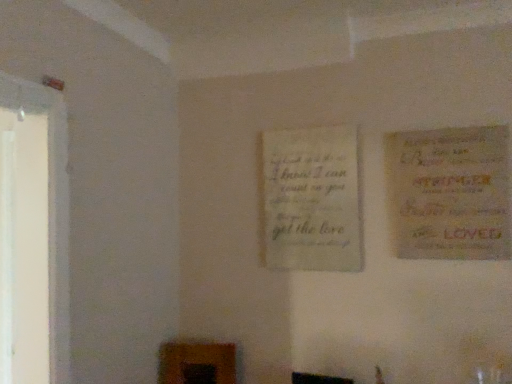
Question: Looking at the image, does light beige paper at center, the first poster from the left, seem bigger or smaller compared to yellow paper poster at right, which appears as the 1th poster when viewed from the right?

Choices:
 (A) small
 (B) big

Answer: (A)

Question: From a real-world perspective, is light beige paper at center, the 2th poster in the right-to-left sequence, physically located above or below yellow paper poster at right, acting as the first poster starting from the front?

Choices:
 (A) above
 (B) below

Answer: (B)

Question: Is point (307, 220) closer or farther from the camera than point (501, 172)?

Choices:
 (A) closer
 (B) farther

Answer: (B)

Question: From the image's perspective, is yellow paper poster at right, which appears as the 1th poster when viewed from the right, above or below light beige paper at center, marked as the first poster in a back-to-front arrangement?

Choices:
 (A) above
 (B) below

Answer: (A)

Question: Is yellow paper poster at right, marked as the 2th poster in a left-to-right arrangement, in front of or behind light beige paper at center, the 2th poster in the right-to-left sequence, in the image?

Choices:
 (A) front
 (B) behind

Answer: (A)

Question: Considering the positions of yellow paper poster at right, which ranks as the second poster in back-to-front order, and light beige paper at center, the first poster from the left, in the image, is yellow paper poster at right, which ranks as the second poster in back-to-front order, wider or thinner than light beige paper at center, the first poster from the left,?

Choices:
 (A) thin
 (B) wide

Answer: (B)

Question: Is point (432, 147) closer or farther from the camera than point (344, 144)?

Choices:
 (A) farther
 (B) closer

Answer: (B)